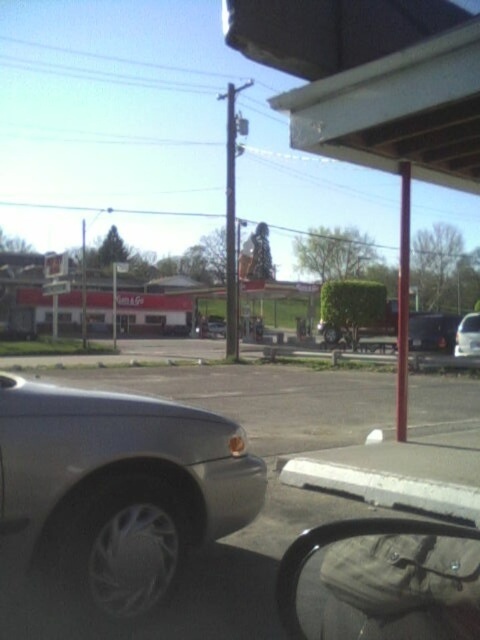
Question: Estimate the real-world distances between objects in this image. Which object is closer to the satin black sedan at center?

Choices:
 (A) gray asphalt parking lot at center
 (B) silver metallic car at lower left

Answer: (A)

Question: From the image, what is the correct spatial relationship of silver metallic car at lower left in relation to satin black sedan at center?

Choices:
 (A) left
 (B) right

Answer: (A)

Question: Which object is the farthest from the satin black sedan at center?

Choices:
 (A) gray asphalt parking lot at center
 (B) silver metallic car at lower left

Answer: (B)

Question: Is gray asphalt parking lot at center closer to the viewer compared to satin black sedan at center?

Choices:
 (A) yes
 (B) no

Answer: (A)

Question: Which point is farther to the camera?

Choices:
 (A) gray asphalt parking lot at center
 (B) silver metallic car at lower left
 (C) satin black sedan at center

Answer: (C)

Question: Considering the relative positions of silver metallic car at lower left and satin black sedan at center in the image provided, where is silver metallic car at lower left located with respect to satin black sedan at center?

Choices:
 (A) right
 (B) left

Answer: (B)